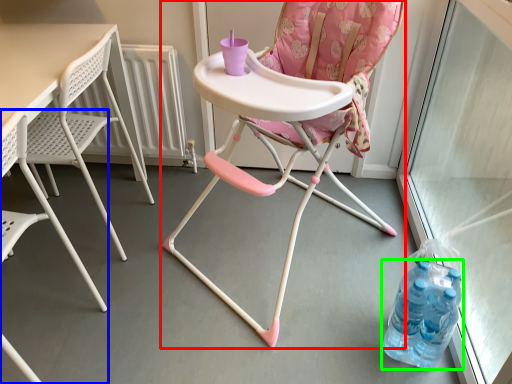
Question: Based on their relative distances, which object is farther from chair (highlighted by a red box)? Choose from chair (highlighted by a blue box) and bottle (highlighted by a green box).

Choices:
 (A) chair
 (B) bottle

Answer: (A)